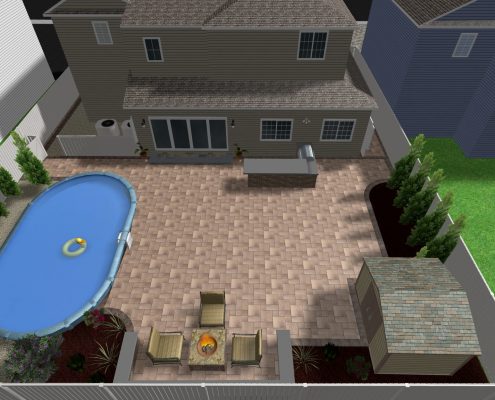
Find the location of a particular element. fireplace is located at coordinates (207, 341).